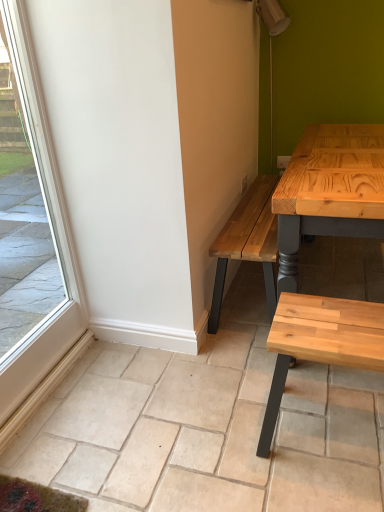
Question: Is clear glass window at left oriented towards natural wood bench at lower right?

Choices:
 (A) yes
 (B) no

Answer: (A)

Question: Is clear glass window at left behind natural wood bench at lower right?

Choices:
 (A) yes
 (B) no

Answer: (B)

Question: Does clear glass window at left lie in front of natural wood bench at lower right?

Choices:
 (A) yes
 (B) no

Answer: (A)

Question: Could natural wood bench at lower right be considered to be inside clear glass window at left?

Choices:
 (A) yes
 (B) no

Answer: (B)

Question: Is clear glass window at left far from natural wood bench at lower right?

Choices:
 (A) yes
 (B) no

Answer: (A)

Question: Is clear glass window at left at the left side of natural wood bench at lower right?

Choices:
 (A) no
 (B) yes

Answer: (B)

Question: Is natural stone tile at lower center closer to the viewer compared to natural wood bench at lower right?

Choices:
 (A) no
 (B) yes

Answer: (B)

Question: Is natural stone tile at lower center located outside natural wood bench at lower right?

Choices:
 (A) no
 (B) yes

Answer: (B)

Question: Considering the relative sizes of natural stone tile at lower center and natural wood bench at lower right in the image provided, is natural stone tile at lower center shorter than natural wood bench at lower right?

Choices:
 (A) no
 (B) yes

Answer: (B)

Question: Is the surface of natural stone tile at lower center in direct contact with natural wood bench at lower right?

Choices:
 (A) no
 (B) yes

Answer: (A)

Question: Is natural stone tile at lower center aimed at natural wood bench at lower right?

Choices:
 (A) yes
 (B) no

Answer: (B)

Question: From a real-world perspective, is natural stone tile at lower center located beneath natural wood bench at lower right?

Choices:
 (A) no
 (B) yes

Answer: (B)

Question: From a real-world perspective, is natural wood bench at lower right located higher than natural stone tile at lower center?

Choices:
 (A) no
 (B) yes

Answer: (B)